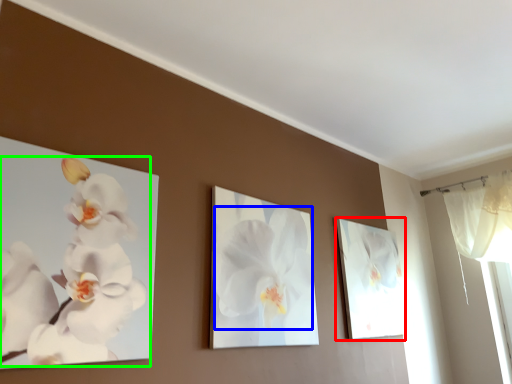
Question: Which is nearer to the picture frame (highlighted by a red box)? flower (highlighted by a blue box) or flower (highlighted by a green box).

Choices:
 (A) flower
 (B) flower

Answer: (A)